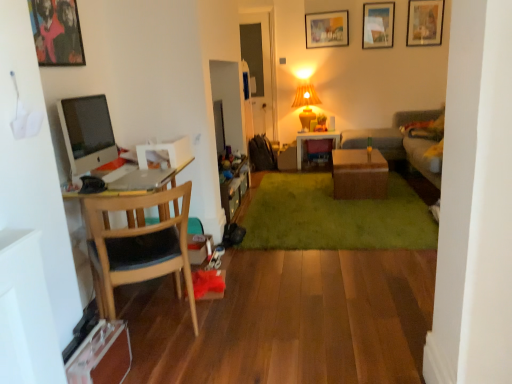
This screenshot has height=384, width=512. Find the location of `vacant space in wooden chair at left (from a real-world perspective)`. vacant space in wooden chair at left (from a real-world perspective) is located at coordinates (160, 332).